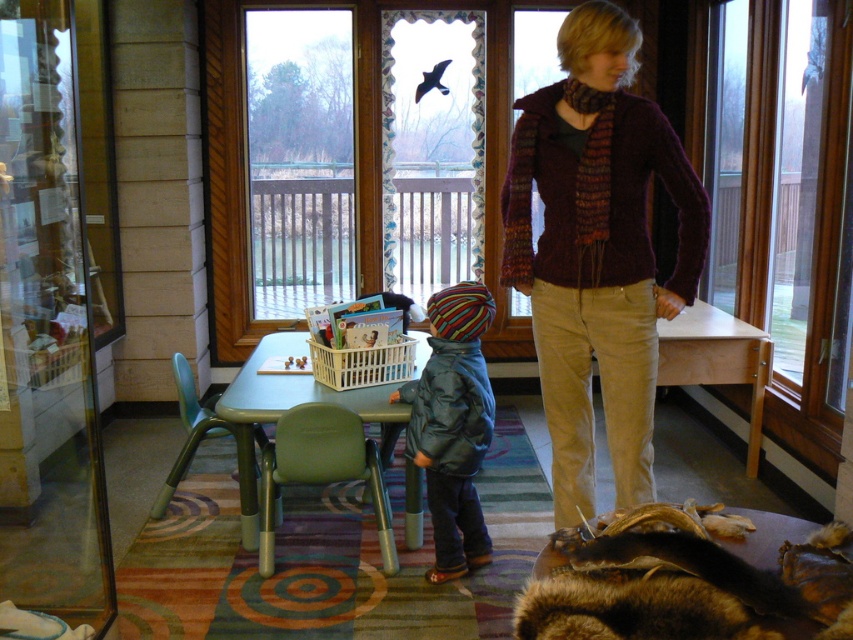
Is white plastic laundry basket at center taller than green plastic chair at lower left?

No, white plastic laundry basket at center is not taller than green plastic chair at lower left.

What do you see at coordinates (363, 364) in the screenshot? The height and width of the screenshot is (640, 853). I see `white plastic laundry basket at center` at bounding box center [363, 364].

Which is in front, point (402, 337) or point (177, 374)?

Point (402, 337) is more forward.

At what (x,y) coordinates should I click in order to perform the action: click on white plastic laundry basket at center. Please return your answer as a coordinate pair (x, y). Looking at the image, I should click on tap(363, 364).

Who is shorter, maroon knitted sweater at center or white plastic laundry basket at center?

With less height is white plastic laundry basket at center.

Which is more to the right, maroon knitted sweater at center or white plastic laundry basket at center?

maroon knitted sweater at center

What do you see at coordinates (596, 252) in the screenshot? This screenshot has height=640, width=853. I see `maroon knitted sweater at center` at bounding box center [596, 252].

Locate an element on the screen. The height and width of the screenshot is (640, 853). maroon knitted sweater at center is located at coordinates (596, 252).

Which is more to the right, maroon knitted sweater at center or green plastic chair at lower center?

maroon knitted sweater at center is more to the right.

Who is lower down, maroon knitted sweater at center or green plastic chair at lower center?

green plastic chair at lower center is lower down.

Does point (602, 212) lie in front of point (296, 422)?

Yes, it is.

In order to click on maroon knitted sweater at center in this screenshot , I will do `click(596, 252)`.